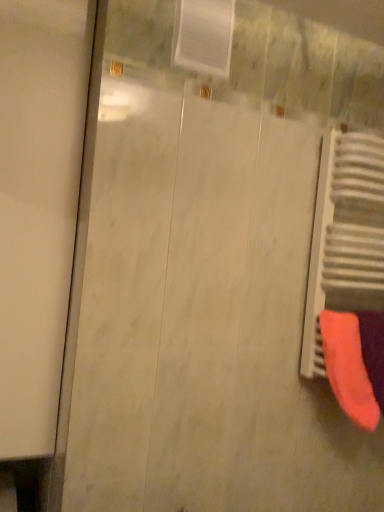
Find the location of `neon pink fabric at lower right`. neon pink fabric at lower right is located at coordinates (355, 362).

What do you see at coordinates (355, 362) in the screenshot?
I see `neon pink fabric at lower right` at bounding box center [355, 362].

Where is `neon pink fabric at lower right`? neon pink fabric at lower right is located at coordinates (355, 362).